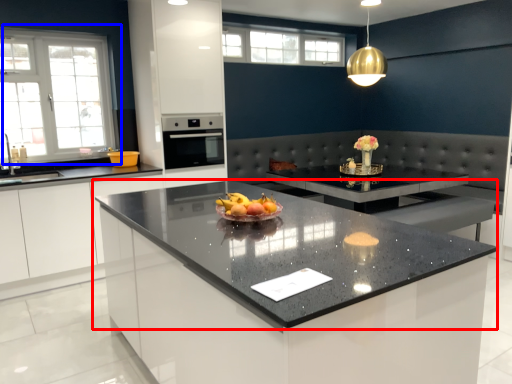
Question: Which point is further to the camera, countertop (highlighted by a red box) or window (highlighted by a blue box)?

Choices:
 (A) countertop
 (B) window

Answer: (B)